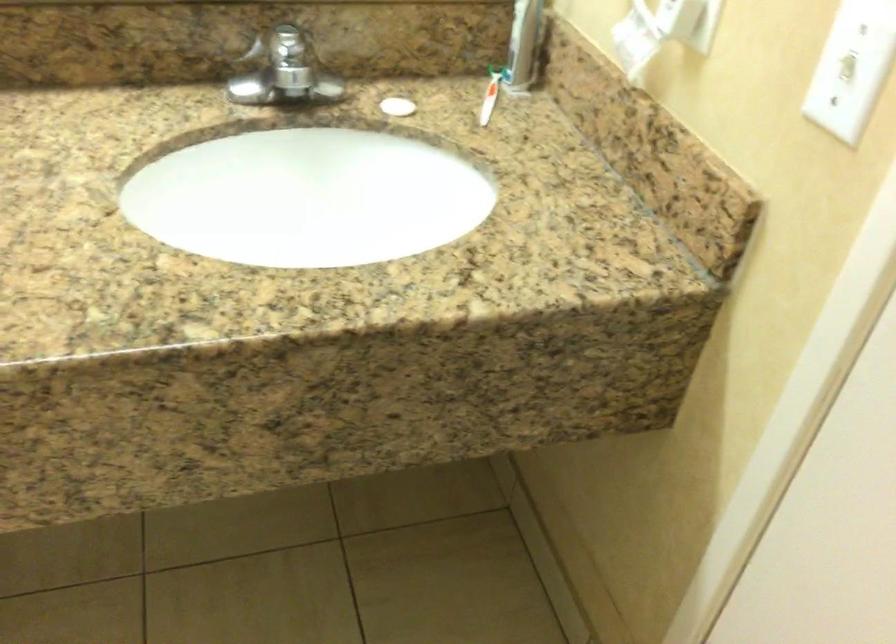
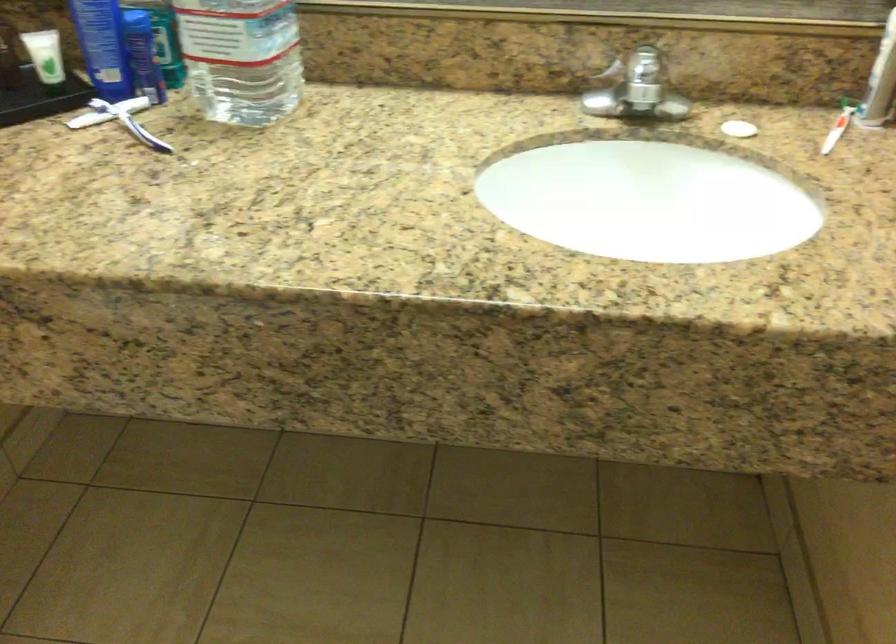
Question: How did the camera likely rotate?

Choices:
 (A) Left
 (B) Right
 (C) Up
 (D) Down

Answer: (A)